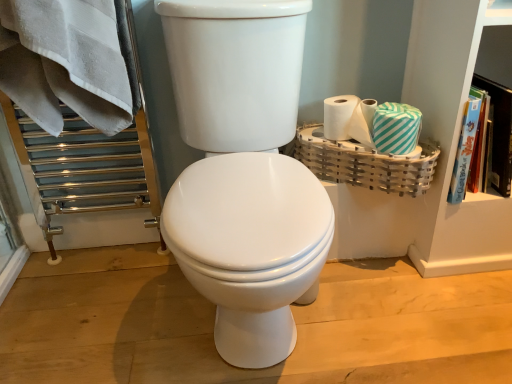
Question: From the image's perspective, is teal striped tissue at right above white glossy toilet at center?

Choices:
 (A) yes
 (B) no

Answer: (A)

Question: Is teal striped tissue at right outside of white glossy toilet at center?

Choices:
 (A) no
 (B) yes

Answer: (B)

Question: Considering the relative sizes of teal striped tissue at right and white glossy toilet at center in the image provided, is teal striped tissue at right wider than white glossy toilet at center?

Choices:
 (A) yes
 (B) no

Answer: (B)

Question: Considering the relative sizes of teal striped tissue at right and white glossy toilet at center in the image provided, is teal striped tissue at right thinner than white glossy toilet at center?

Choices:
 (A) no
 (B) yes

Answer: (B)

Question: Considering the relative sizes of teal striped tissue at right and white glossy toilet at center in the image provided, is teal striped tissue at right taller than white glossy toilet at center?

Choices:
 (A) no
 (B) yes

Answer: (A)

Question: Is green striped toilet paper at right in front of or behind bamboo basket at right in the image?

Choices:
 (A) front
 (B) behind

Answer: (B)

Question: From the image's perspective, is green striped toilet paper at right positioned above or below bamboo basket at right?

Choices:
 (A) above
 (B) below

Answer: (A)

Question: In the image, is green striped toilet paper at right on the left side or the right side of bamboo basket at right?

Choices:
 (A) left
 (B) right

Answer: (B)

Question: Is green striped toilet paper at right bigger or smaller than bamboo basket at right?

Choices:
 (A) small
 (B) big

Answer: (A)

Question: Is bamboo basket at right situated inside white glossy toilet at center or outside?

Choices:
 (A) outside
 (B) inside

Answer: (A)

Question: From a real-world perspective, is bamboo basket at right physically located above or below white glossy toilet at center?

Choices:
 (A) below
 (B) above

Answer: (A)

Question: From the image's perspective, is bamboo basket at right located above or below white glossy toilet at center?

Choices:
 (A) above
 (B) below

Answer: (A)

Question: From their relative heights in the image, would you say bamboo basket at right is taller or shorter than white glossy toilet at center?

Choices:
 (A) short
 (B) tall

Answer: (A)

Question: In terms of width, does white glossy toilet at center look wider or thinner when compared to teal striped tissue at right?

Choices:
 (A) wide
 (B) thin

Answer: (A)

Question: Relative to teal striped tissue at right, is white glossy toilet at center in front or behind?

Choices:
 (A) behind
 (B) front

Answer: (B)